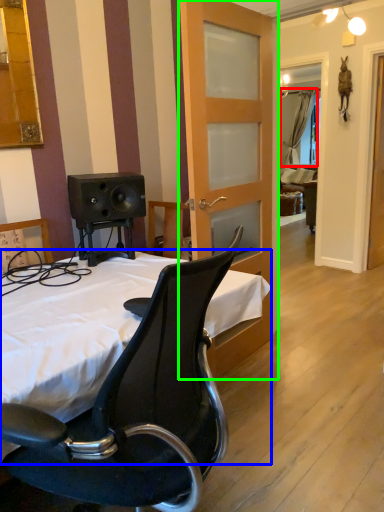
Question: Based on their relative distances, which object is nearer to curtain (highlighted by a red box)? Choose from bed (highlighted by a blue box) and door (highlighted by a green box).

Choices:
 (A) bed
 (B) door

Answer: (B)